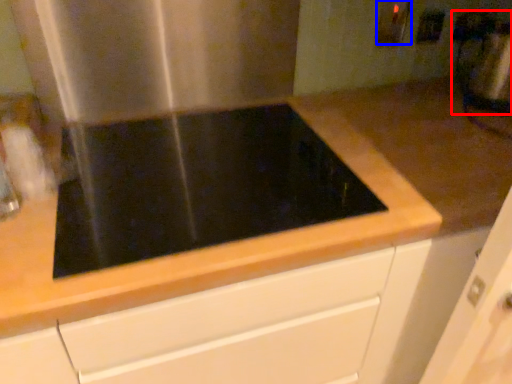
Question: Among these objects, which one is nearest to the camera, blender (highlighted by a red box) or electric outlet (highlighted by a blue box)?

Choices:
 (A) blender
 (B) electric outlet

Answer: (A)